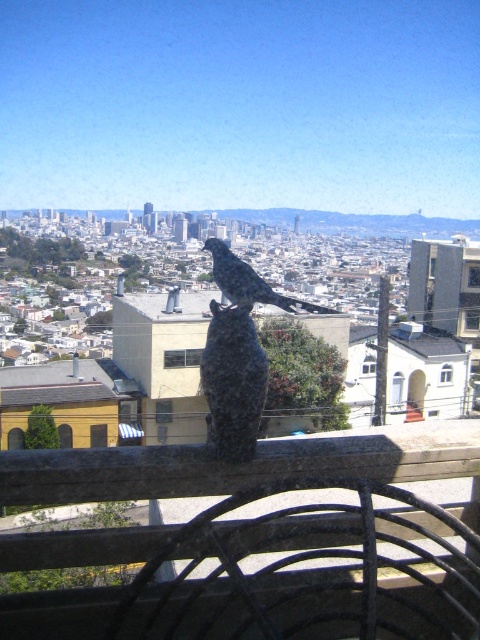
Based on the photo, measure the distance between granite statue at center and camera.

granite statue at center is 22.41 meters away from camera.

Based on the photo, is granite statue at center wider than rustic stone bird at center?

Incorrect, granite statue at center's width does not surpass rustic stone bird at center's.

Which is in front, point (216, 454) or point (228, 296)?

Point (216, 454) is in front.

You are a GUI agent. You are given a task and a screenshot of the screen. Output one action in this format:
    pyautogui.click(x=<x>, y=<y>)
    Task: Click on the granite statue at center
    The width and height of the screenshot is (480, 640).
    Given the screenshot: What is the action you would take?
    pyautogui.click(x=232, y=381)